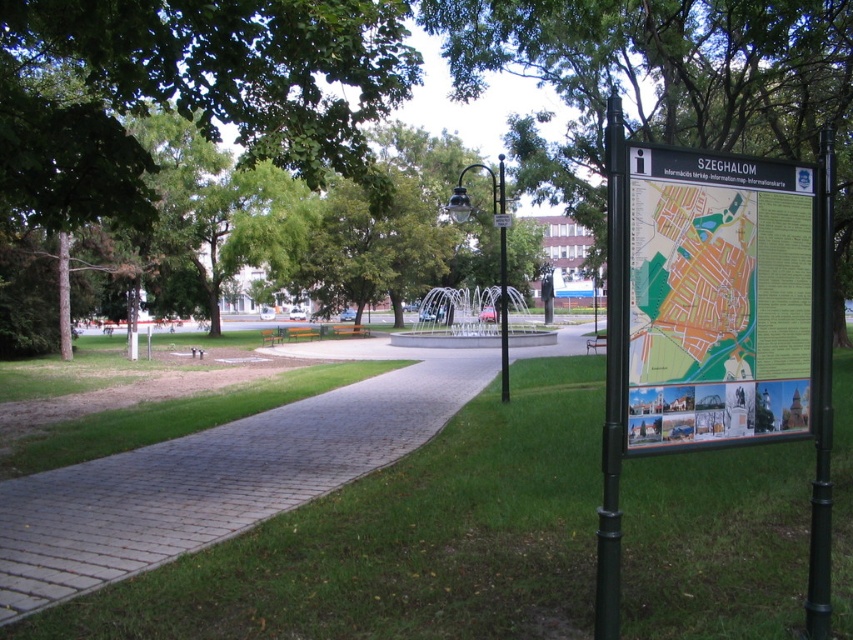
Question: Where is matte plastic map at right located in relation to black metal pole at right in the image?

Choices:
 (A) below
 (B) above

Answer: (A)

Question: Is black metal pole at right wider than metallic pole at center?

Choices:
 (A) no
 (B) yes

Answer: (B)

Question: Can you confirm if green leafy tree at center is positioned below black metal signpost at right?

Choices:
 (A) no
 (B) yes

Answer: (A)

Question: Which of the following is the closest to the observer?

Choices:
 (A) [827, 248]
 (B) [346, 61]
 (C) [721, 419]

Answer: (C)

Question: Estimate the real-world distances between objects in this image. Which object is closer to the metallic pole at center?

Choices:
 (A) black metal pole at right
 (B) paved stone path at center
 (C) green leafy tree at center

Answer: (C)

Question: Which is farther from the paved stone path at center?

Choices:
 (A) black metal pole at right
 (B) metallic pole at center

Answer: (B)